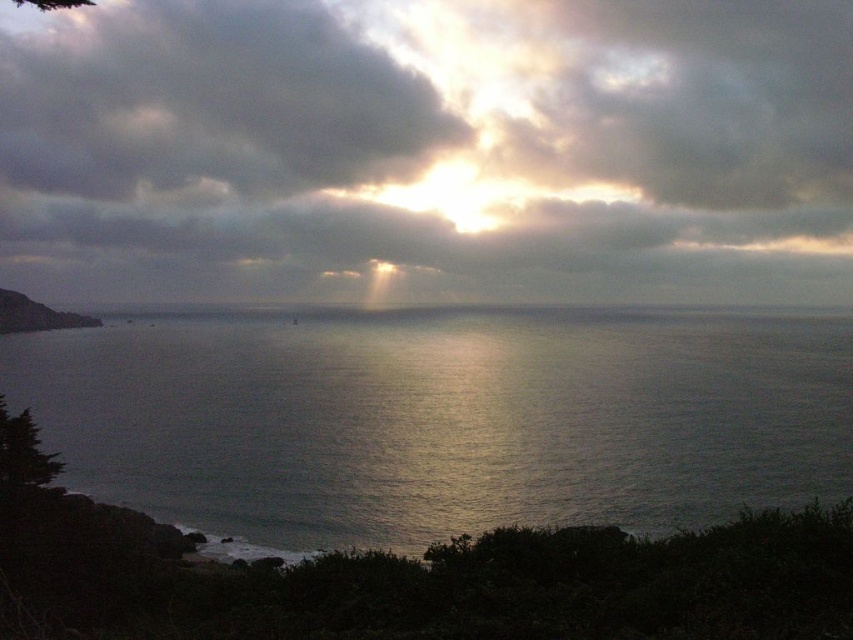
Question: Does cloudy sky at upper center appear over glistening silver water at center?

Choices:
 (A) yes
 (B) no

Answer: (A)

Question: Which point appears farthest from the camera in this image?

Choices:
 (A) click(x=184, y=273)
 (B) click(x=460, y=360)

Answer: (A)

Question: Is cloudy sky at upper center thinner than glistening silver water at center?

Choices:
 (A) no
 (B) yes

Answer: (A)

Question: Does cloudy sky at upper center have a greater width compared to glistening silver water at center?

Choices:
 (A) yes
 (B) no

Answer: (A)

Question: Which object appears farthest from the camera in this image?

Choices:
 (A) glistening silver water at center
 (B) cloudy sky at upper center

Answer: (B)